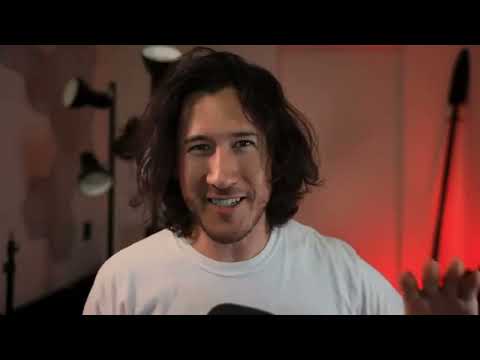
Locate an element on the screen. light fixture is located at coordinates (77, 94), (91, 166), (156, 68).